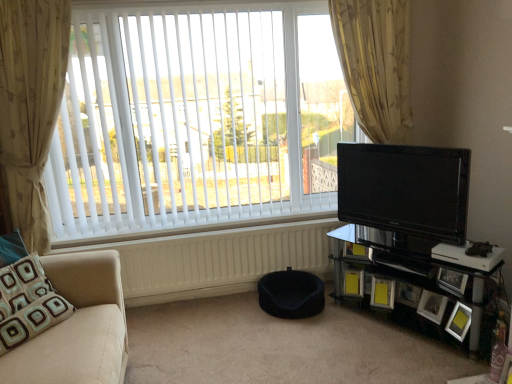
Where is `vacant region to the right of black fabric bean bag at center`? Image resolution: width=512 pixels, height=384 pixels. vacant region to the right of black fabric bean bag at center is located at coordinates (354, 314).